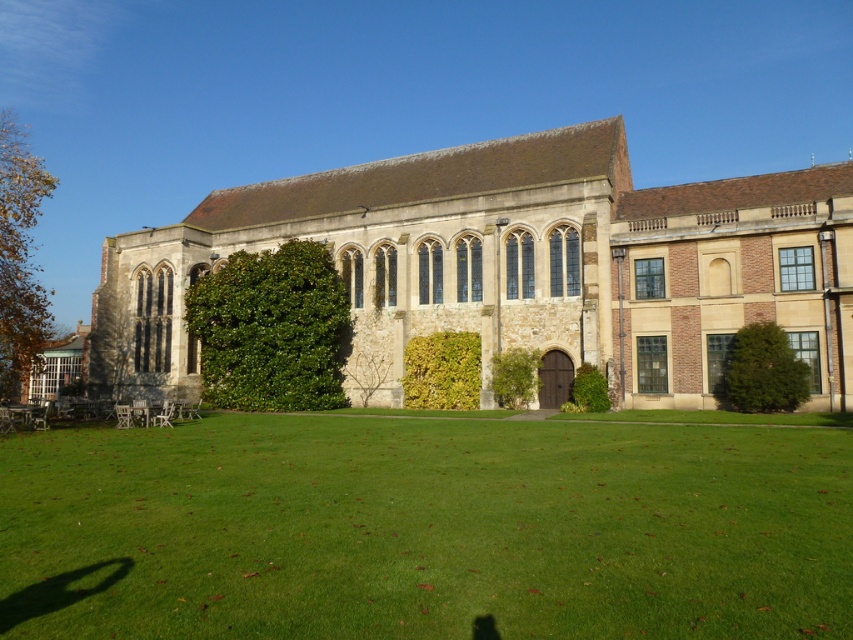
Question: Is green grass at lower center behind stone church at center?

Choices:
 (A) no
 (B) yes

Answer: (A)

Question: Can you confirm if green grass at lower center is thinner than stone church at center?

Choices:
 (A) no
 (B) yes

Answer: (B)

Question: Observing the image, what is the correct spatial positioning of green grass at lower center in reference to stone church at center?

Choices:
 (A) below
 (B) above

Answer: (A)

Question: Among these points, which one is nearest to the camera?

Choices:
 (A) (285, 618)
 (B) (601, 298)

Answer: (A)

Question: Which object is farther from the camera taking this photo?

Choices:
 (A) green grass at lower center
 (B) stone church at center

Answer: (B)